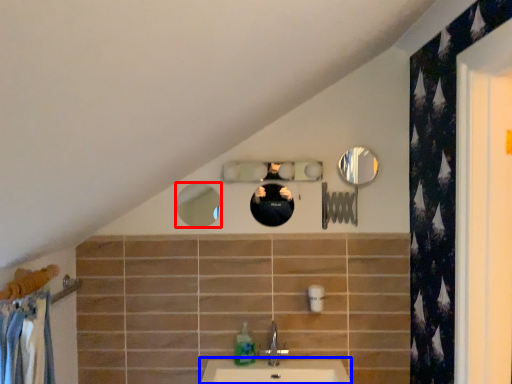
Question: Among these objects, which one is farthest to the camera, mirror (highlighted by a red box) or counter top (highlighted by a blue box)?

Choices:
 (A) mirror
 (B) counter top

Answer: (A)